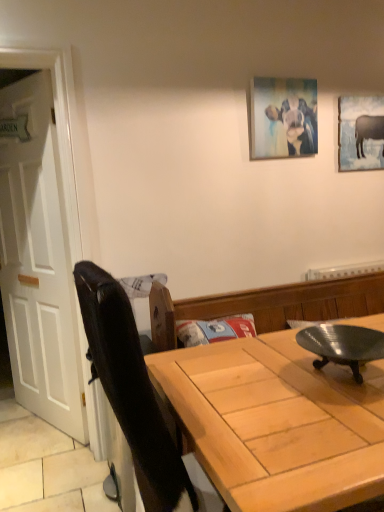
Identify the location of free region under white wooden door at left (from a real-world perspective). This screenshot has width=384, height=512. (36, 418).